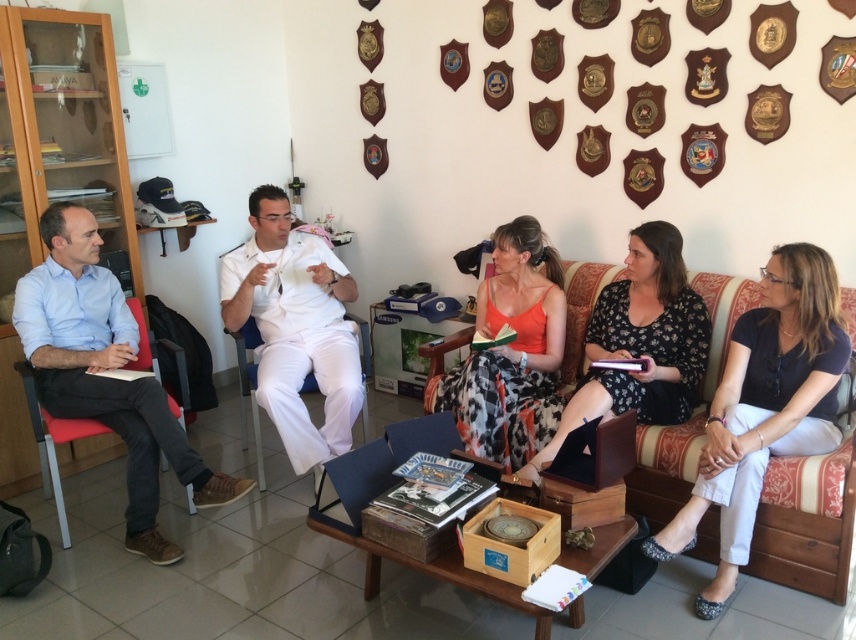
Question: Can you confirm if white cotton pants at lower right is thinner than light blue cotton shirt at left?

Choices:
 (A) yes
 (B) no

Answer: (A)

Question: Which point is closer to the camera taking this photo?

Choices:
 (A) (854, 499)
 (B) (514, 435)

Answer: (A)

Question: Can you confirm if white cotton pants at lower right is wider than white matte uniform at center?

Choices:
 (A) no
 (B) yes

Answer: (B)

Question: Among these objects, which one is nearest to the camera?

Choices:
 (A) white cotton pants at lower right
 (B) white matte uniform at center
 (C) wooden couch at lower right

Answer: (C)

Question: Which point is closer to the camera?

Choices:
 (A) (510, 298)
 (B) (308, 268)

Answer: (B)

Question: Is white matte uniform at center positioned before orange fabric dress at center?

Choices:
 (A) yes
 (B) no

Answer: (B)